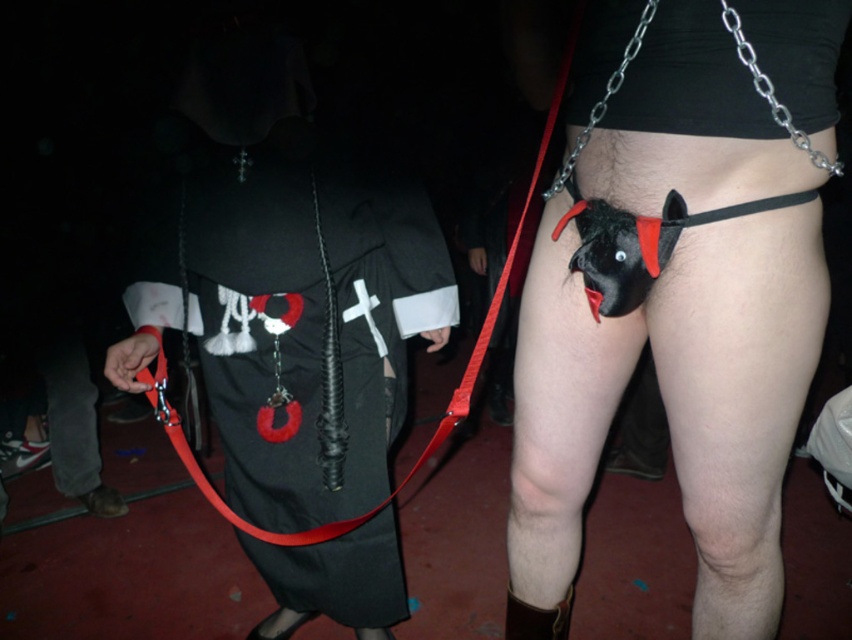
Question: Which point is closer to the camera taking this photo?

Choices:
 (A) (709, 454)
 (B) (645, 28)

Answer: (B)

Question: Among these points, which one is farthest from the camera?

Choices:
 (A) (560, 177)
 (B) (89, 387)

Answer: (B)

Question: Among these objects, which one is nearest to the camera?

Choices:
 (A) brown suede boot at lower left
 (B) matte black costume at center
 (C) metallic chain at lower center
 (D) black rubber whip at center

Answer: (C)

Question: Where is black matte thong at lower right located in relation to brown leather boot at lower center in the image?

Choices:
 (A) left
 (B) right

Answer: (B)

Question: Does black matte thong at lower right lie in front of black matte gimp mask at lower right?

Choices:
 (A) no
 (B) yes

Answer: (B)

Question: Is black matte thong at lower right bigger than black matte gimp mask at lower right?

Choices:
 (A) yes
 (B) no

Answer: (A)